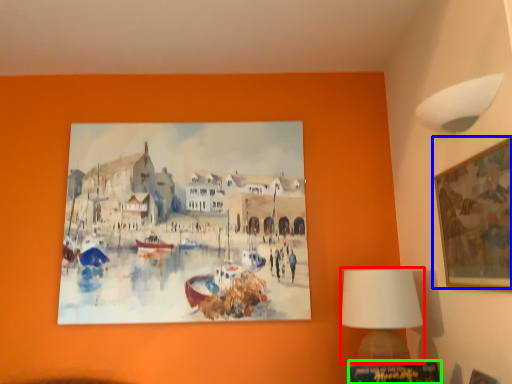
Question: Which object is the closest to the table lamp (highlighted by a red box)? Choose among these: picture frame (highlighted by a blue box) or picture frame (highlighted by a green box).

Choices:
 (A) picture frame
 (B) picture frame

Answer: (B)